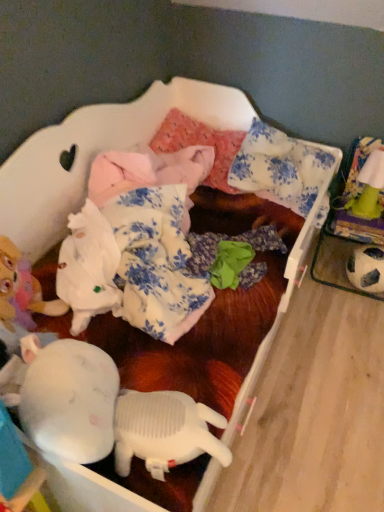
The width and height of the screenshot is (384, 512). What do you see at coordinates (201, 145) in the screenshot?
I see `pink fabric pillow at center, the 1th pillow viewed from the left` at bounding box center [201, 145].

What do you see at coordinates (367, 269) in the screenshot? The width and height of the screenshot is (384, 512). I see `black and white textured soccer ball at right, positioned as the second toy in top-to-bottom order` at bounding box center [367, 269].

This screenshot has width=384, height=512. I want to click on white floral fabric pillow at upper center, arranged as the second pillow when viewed from the left, so click(x=279, y=168).

Image resolution: width=384 pixels, height=512 pixels. What are the coordinates of `green fabric toy at upper right, which is the second toy from bottom to top` in the screenshot? It's located at (369, 187).

This screenshot has height=512, width=384. I want to click on pink fabric pillow at center, placed as the second pillow when sorted from right to left, so click(x=201, y=145).

Is white floral fabric pillow at upper center, arranged as the second pillow when viewed from the left, turned away from black and white textured soccer ball at right, which ranks as the 1th toy in bottom-to-top order?

white floral fabric pillow at upper center, arranged as the second pillow when viewed from the left, does not have its back to black and white textured soccer ball at right, which ranks as the 1th toy in bottom-to-top order.

Does white floral fabric pillow at upper center, acting as the first pillow starting from the right, have a lesser height compared to black and white textured soccer ball at right, positioned as the second toy in top-to-bottom order?

In fact, white floral fabric pillow at upper center, acting as the first pillow starting from the right, may be taller than black and white textured soccer ball at right, positioned as the second toy in top-to-bottom order.

Find the location of a particular element. The height and width of the screenshot is (512, 384). the 1st pillow to the left when counting from the black and white textured soccer ball at right, positioned as the second toy in top-to-bottom order is located at coordinates (279, 168).

From a real-world perspective, starting from the pink fabric pillow at center, placed as the second pillow when sorted from right to left, which toy is the 2nd one below it? Please provide its 2D coordinates.

[(367, 269)]

From a real-world perspective, is black and white textured soccer ball at right, which ranks as the 1th toy in bottom-to-top order, positioned above or below pink fabric pillow at center, the 1th pillow viewed from the left?

black and white textured soccer ball at right, which ranks as the 1th toy in bottom-to-top order, is below pink fabric pillow at center, the 1th pillow viewed from the left.

Does black and white textured soccer ball at right, positioned as the second toy in top-to-bottom order, have a greater width compared to pink fabric pillow at center, the 1th pillow viewed from the left?

No, black and white textured soccer ball at right, positioned as the second toy in top-to-bottom order, is not wider than pink fabric pillow at center, the 1th pillow viewed from the left.

Can you confirm if black and white textured soccer ball at right, positioned as the second toy in top-to-bottom order, is taller than pink fabric pillow at center, placed as the second pillow when sorted from right to left?

In fact, black and white textured soccer ball at right, positioned as the second toy in top-to-bottom order, may be shorter than pink fabric pillow at center, placed as the second pillow when sorted from right to left.

Could you measure the distance between pink fabric pillow at center, the 1th pillow viewed from the left, and white floral fabric pillow at upper center, arranged as the second pillow when viewed from the left?

A distance of 8.03 inches exists between pink fabric pillow at center, the 1th pillow viewed from the left, and white floral fabric pillow at upper center, arranged as the second pillow when viewed from the left.

Looking at this image, from the image's perspective, who appears lower, pink fabric pillow at center, placed as the second pillow when sorted from right to left, or white floral fabric pillow at upper center, arranged as the second pillow when viewed from the left?

white floral fabric pillow at upper center, arranged as the second pillow when viewed from the left, is shown below in the image.

Can you confirm if pink fabric pillow at center, the 1th pillow viewed from the left, is shorter than white floral fabric pillow at upper center, acting as the first pillow starting from the right?

Correct, pink fabric pillow at center, the 1th pillow viewed from the left, is not as tall as white floral fabric pillow at upper center, acting as the first pillow starting from the right.

Considering the positions of objects pink fabric pillow at center, the 1th pillow viewed from the left, and white floral fabric pillow at upper center, acting as the first pillow starting from the right, in the image provided, who is more to the right, pink fabric pillow at center, the 1th pillow viewed from the left, or white floral fabric pillow at upper center, acting as the first pillow starting from the right,?

white floral fabric pillow at upper center, acting as the first pillow starting from the right.

Between black and white textured soccer ball at right, positioned as the second toy in top-to-bottom order, and green fabric toy at upper right, which is the second toy from bottom to top, which one has smaller size?

green fabric toy at upper right, which is the second toy from bottom to top.

Between black and white textured soccer ball at right, positioned as the second toy in top-to-bottom order, and green fabric toy at upper right, which is the second toy from bottom to top, which one appears on the left side from the viewer's perspective?

green fabric toy at upper right, which is the second toy from bottom to top.

This screenshot has height=512, width=384. Identify the location of toy located below the green fabric toy at upper right, which is the second toy from bottom to top (from the image's perspective). (367, 269).

Which object is wider, black and white textured soccer ball at right, positioned as the second toy in top-to-bottom order, or green fabric toy at upper right, which is the second toy from bottom to top?

With larger width is black and white textured soccer ball at right, positioned as the second toy in top-to-bottom order.

Between black and white textured soccer ball at right, which ranks as the 1th toy in bottom-to-top order, and white floral fabric pillow at upper center, arranged as the second pillow when viewed from the left, which one has less height?

black and white textured soccer ball at right, which ranks as the 1th toy in bottom-to-top order.

Which object is wider, black and white textured soccer ball at right, which ranks as the 1th toy in bottom-to-top order, or white floral fabric pillow at upper center, arranged as the second pillow when viewed from the left?

white floral fabric pillow at upper center, arranged as the second pillow when viewed from the left.

Looking at the image, does black and white textured soccer ball at right, positioned as the second toy in top-to-bottom order, seem bigger or smaller compared to white floral fabric pillow at upper center, arranged as the second pillow when viewed from the left?

black and white textured soccer ball at right, positioned as the second toy in top-to-bottom order, is smaller than white floral fabric pillow at upper center, arranged as the second pillow when viewed from the left.

Is white floral fabric pillow at upper center, acting as the first pillow starting from the right, bigger or smaller than green fabric toy at upper right, which is the second toy from bottom to top?

Considering their sizes, white floral fabric pillow at upper center, acting as the first pillow starting from the right, takes up more space than green fabric toy at upper right, which is the second toy from bottom to top.

Between point (252, 165) and point (371, 167), which one is positioned in front?

The point (252, 165) is in front.

Between white floral fabric pillow at upper center, arranged as the second pillow when viewed from the left, and green fabric toy at upper right, which is the second toy from bottom to top, which one is positioned in front?

white floral fabric pillow at upper center, arranged as the second pillow when viewed from the left, is more forward.

Are pink fabric pillow at center, placed as the second pillow when sorted from right to left, and green fabric toy at upper right, which is the second toy from bottom to top, making contact?

No, pink fabric pillow at center, placed as the second pillow when sorted from right to left, is not with green fabric toy at upper right, which is the second toy from bottom to top.

How much distance is there between pink fabric pillow at center, placed as the second pillow when sorted from right to left, and green fabric toy at upper right, which is the second toy from bottom to top?

25.89 inches.

Considering the sizes of objects pink fabric pillow at center, the 1th pillow viewed from the left, and green fabric toy at upper right, which is the second toy from bottom to top, in the image provided, who is taller, pink fabric pillow at center, the 1th pillow viewed from the left, or green fabric toy at upper right, which is the second toy from bottom to top,?

Standing taller between the two is green fabric toy at upper right, which is the second toy from bottom to top.

From the image's perspective, count 2nd toys downward from the white floral fabric pillow at upper center, arranged as the second pillow when viewed from the left, and point to it. Please provide its 2D coordinates.

[(367, 269)]

Where is `pillow behind the black and white textured soccer ball at right, which ranks as the 1th toy in bottom-to-top order`? Image resolution: width=384 pixels, height=512 pixels. pillow behind the black and white textured soccer ball at right, which ranks as the 1th toy in bottom-to-top order is located at coordinates click(x=201, y=145).

From the image, which object appears to be farther from pink fabric pillow at center, the 1th pillow viewed from the left, black and white textured soccer ball at right, positioned as the second toy in top-to-bottom order, or white floral fabric pillow at upper center, arranged as the second pillow when viewed from the left?

black and white textured soccer ball at right, positioned as the second toy in top-to-bottom order, is further to pink fabric pillow at center, the 1th pillow viewed from the left.

Considering their positions, is green fabric toy at upper right, arranged as the 1th toy when viewed from the top, positioned further to white floral fabric pillow at upper center, acting as the first pillow starting from the right, than black and white textured soccer ball at right, positioned as the second toy in top-to-bottom order?

Among the two, black and white textured soccer ball at right, positioned as the second toy in top-to-bottom order, is located further to white floral fabric pillow at upper center, acting as the first pillow starting from the right.

From the image, which object appears to be nearer to black and white textured soccer ball at right, which ranks as the 1th toy in bottom-to-top order, green fabric toy at upper right, which is the second toy from bottom to top, or white floral fabric pillow at upper center, acting as the first pillow starting from the right?

green fabric toy at upper right, which is the second toy from bottom to top, lies closer to black and white textured soccer ball at right, which ranks as the 1th toy in bottom-to-top order, than the other object.

Which object lies nearer to the anchor point green fabric toy at upper right, which is the second toy from bottom to top, white floral fabric pillow at upper center, arranged as the second pillow when viewed from the left, or pink fabric pillow at center, placed as the second pillow when sorted from right to left?

white floral fabric pillow at upper center, arranged as the second pillow when viewed from the left, lies closer to green fabric toy at upper right, which is the second toy from bottom to top, than the other object.

Estimate the real-world distances between objects in this image. Which object is further from white floral fabric pillow at upper center, arranged as the second pillow when viewed from the left, pink fabric pillow at center, placed as the second pillow when sorted from right to left, or black and white textured soccer ball at right, positioned as the second toy in top-to-bottom order?

Based on the image, black and white textured soccer ball at right, positioned as the second toy in top-to-bottom order, appears to be further to white floral fabric pillow at upper center, arranged as the second pillow when viewed from the left.

Which object lies further to the anchor point black and white textured soccer ball at right, positioned as the second toy in top-to-bottom order, white floral fabric pillow at upper center, acting as the first pillow starting from the right, or green fabric toy at upper right, arranged as the 1th toy when viewed from the top?

white floral fabric pillow at upper center, acting as the first pillow starting from the right, is positioned further to the anchor black and white textured soccer ball at right, positioned as the second toy in top-to-bottom order.

Which object lies nearer to the anchor point black and white textured soccer ball at right, which ranks as the 1th toy in bottom-to-top order, pink fabric pillow at center, placed as the second pillow when sorted from right to left, or white floral fabric pillow at upper center, arranged as the second pillow when viewed from the left?

Based on the image, white floral fabric pillow at upper center, arranged as the second pillow when viewed from the left, appears to be nearer to black and white textured soccer ball at right, which ranks as the 1th toy in bottom-to-top order.

Looking at the image, which one is located closer to pink fabric pillow at center, placed as the second pillow when sorted from right to left, white floral fabric pillow at upper center, acting as the first pillow starting from the right, or black and white textured soccer ball at right, which ranks as the 1th toy in bottom-to-top order?

The object closer to pink fabric pillow at center, placed as the second pillow when sorted from right to left, is white floral fabric pillow at upper center, acting as the first pillow starting from the right.

Image resolution: width=384 pixels, height=512 pixels. What are the coordinates of `toy situated between pink fabric pillow at center, placed as the second pillow when sorted from right to left, and black and white textured soccer ball at right, which ranks as the 1th toy in bottom-to-top order, from left to right` in the screenshot? It's located at (369, 187).

Where is `pillow between pink fabric pillow at center, placed as the second pillow when sorted from right to left, and green fabric toy at upper right, which is the second toy from bottom to top, in the horizontal direction`? pillow between pink fabric pillow at center, placed as the second pillow when sorted from right to left, and green fabric toy at upper right, which is the second toy from bottom to top, in the horizontal direction is located at coordinates (279, 168).

Where is `toy between white floral fabric pillow at upper center, arranged as the second pillow when viewed from the left, and black and white textured soccer ball at right, which ranks as the 1th toy in bottom-to-top order, in the vertical direction`? The width and height of the screenshot is (384, 512). toy between white floral fabric pillow at upper center, arranged as the second pillow when viewed from the left, and black and white textured soccer ball at right, which ranks as the 1th toy in bottom-to-top order, in the vertical direction is located at coordinates (369, 187).

Find the location of a particular element. Image resolution: width=384 pixels, height=512 pixels. pillow located between pink fabric pillow at center, the 1th pillow viewed from the left, and black and white textured soccer ball at right, positioned as the second toy in top-to-bottom order, in the left-right direction is located at coordinates (279, 168).